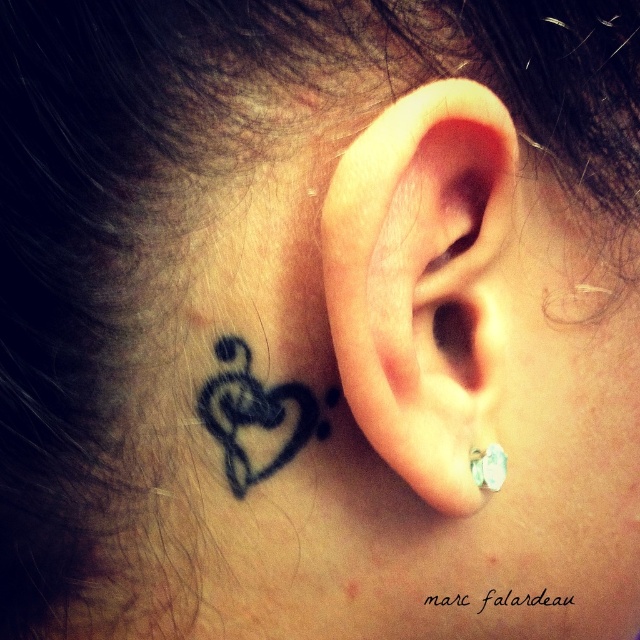
Question: Estimate the real-world distances between objects in this image. Which object is farther from the silver metallic earring at ear?

Choices:
 (A) clear skin ear at center
 (B) black ink heart at upper left

Answer: (B)

Question: Considering the real-world distances, which object is closest to the silver metallic earring at ear?

Choices:
 (A) black ink heart at upper left
 (B) clear skin ear at center

Answer: (B)

Question: Is clear skin ear at center to the left of black ink heart at upper left from the viewer's perspective?

Choices:
 (A) no
 (B) yes

Answer: (A)

Question: Does clear skin ear at center have a greater width compared to silver metallic earring at ear?

Choices:
 (A) yes
 (B) no

Answer: (A)

Question: Is black ink heart at upper left below silver metallic earring at ear?

Choices:
 (A) no
 (B) yes

Answer: (A)

Question: Which point is farther to the camera?

Choices:
 (A) silver metallic earring at ear
 (B) black ink heart at upper left
 (C) clear skin ear at center

Answer: (A)